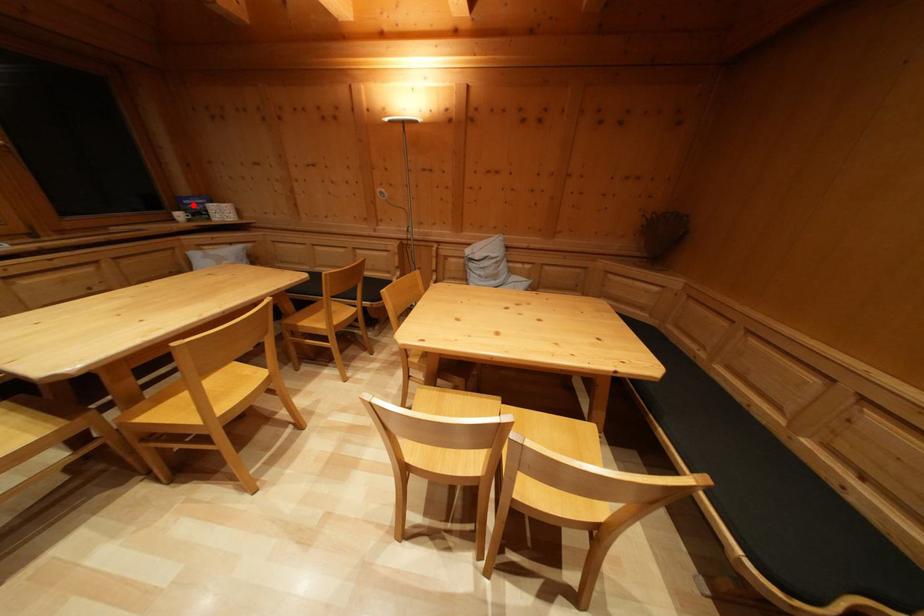
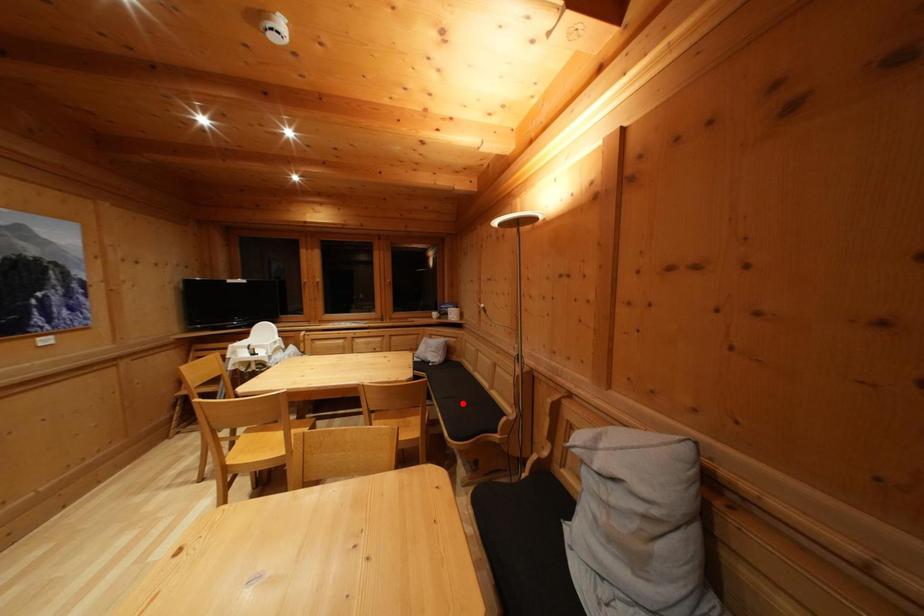
I am providing you with two images of the same scene from different viewpoints. A red point is marked on the first image and another point is marked on the second image. Is the red point in image1 aligned with the point shown in image2?

No